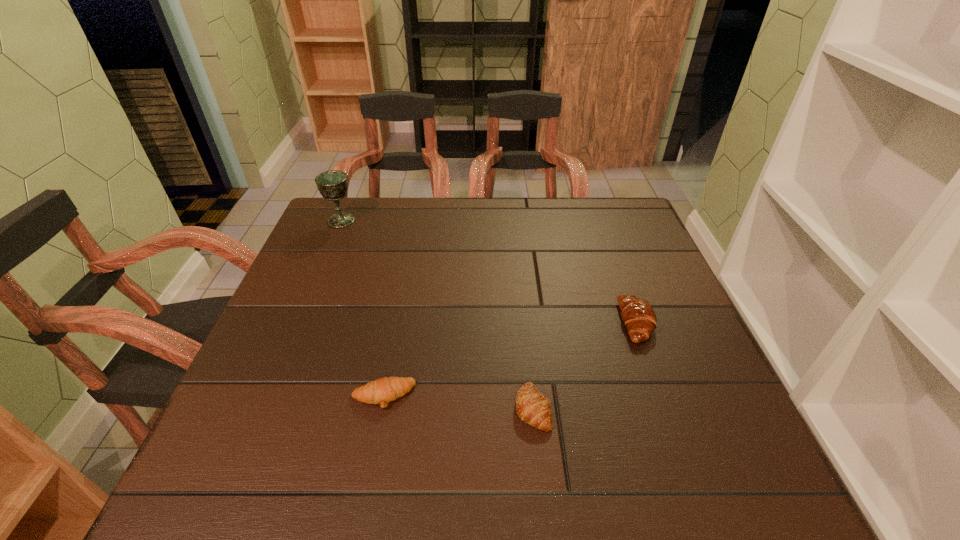
This screenshot has height=540, width=960. Find the location of `free point between the third object from left to right and the second object from left to right`. free point between the third object from left to right and the second object from left to right is located at coordinates 458,402.

Image resolution: width=960 pixels, height=540 pixels. Identify the location of vacant region between the second object from right to left and the rightmost crescent roll. (585, 366).

This screenshot has height=540, width=960. What are the coordinates of `empty space between the leftmost crescent roll and the rightmost crescent roll` in the screenshot? It's located at (510, 360).

Where is `empty space that is in between the third object from left to right and the leftmost object`? The height and width of the screenshot is (540, 960). empty space that is in between the third object from left to right and the leftmost object is located at coordinates (437, 314).

Find the location of a particular element. free space between the rightmost crescent roll and the chalice is located at coordinates (489, 272).

Identify the location of free spot between the leftmost crescent roll and the third object from left to right. The image size is (960, 540). (458, 402).

Locate an element on the screen. Image resolution: width=960 pixels, height=540 pixels. free space that is in between the second crescent roll from right to left and the rightmost object is located at coordinates (585, 366).

The image size is (960, 540). I want to click on free spot between the farthest crescent roll and the third object from right to left, so click(x=510, y=360).

Locate an element on the screen. This screenshot has height=540, width=960. the second closest object to the rightmost crescent roll is located at coordinates 381,391.

Locate an element on the screen. This screenshot has width=960, height=540. the closest object to the rightmost crescent roll is located at coordinates (532, 407).